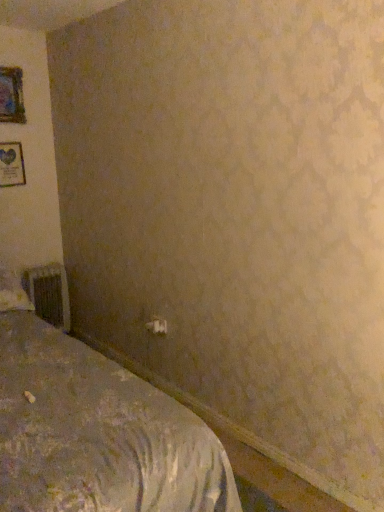
Question: Based on their positions, is metallic silver radiator at lower left located to the left or right of white plastic electric outlet at lower center?

Choices:
 (A) left
 (B) right

Answer: (A)

Question: From the image's perspective, is metallic silver radiator at lower left located above or below white plastic electric outlet at lower center?

Choices:
 (A) above
 (B) below

Answer: (A)

Question: Estimate the real-world distances between objects in this image. Which object is farther from the textured gray bed at lower left?

Choices:
 (A) metallic silver radiator at lower left
 (B) white plastic electric outlet at lower center
 (C) white fabric pillow at left
 (D) wooden framed poster at upper left, positioned as the 1th picture frame in bottom-to-top order
 (E) wooden picture frame at upper left, the second picture frame from the bottom

Answer: (E)

Question: Estimate the real-world distances between objects in this image. Which object is closer to the wooden picture frame at upper left, arranged as the 1th picture frame when viewed from the top?

Choices:
 (A) textured gray bed at lower left
 (B) white plastic electric outlet at lower center
 (C) metallic silver radiator at lower left
 (D) white fabric pillow at left
 (E) wooden framed poster at upper left, which ranks as the 2th picture frame in top-to-bottom order

Answer: (E)